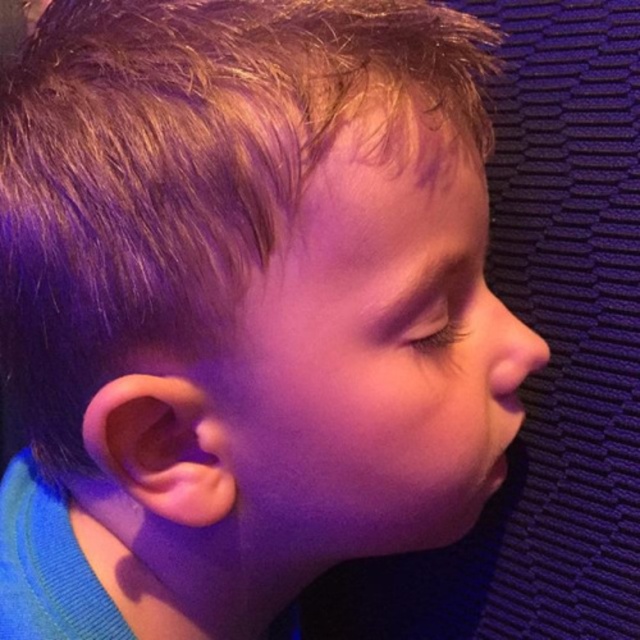
You are a photographer adjusting the lighting for a portrait. The subject has blonde smooth hair at upper left and a smooth flesh nose at center. You need to ensure the lighting reaches both areas equally. Given the distance between them, will you need to adjust the light source closer or farther away to achieve even illumination?

The blonde smooth hair at upper left is 7.15 inches from the smooth flesh nose at center. To achieve even illumination, the light source should be positioned farther away so that the distance difference between the light and both areas is minimized, ensuring consistent lighting across both the blonde smooth hair at upper left and the smooth flesh nose at center.

You are standing in front of the child in the image and want to place a small sticker exactly at point (228, 253). Considering the distance between you and the child, can you estimate how far you need to reach to place the sticker accurately?

The distance between you and point (228, 253) is 12.37 inches, so you need to reach approximately 12.37 inches to place the sticker accurately.

You are a photographer trying to capture a close portrait of a child. You need to ensure that both the blonde smooth hair at upper left and the smooth skin face at center are in focus. Given that your camera can only focus on objects within a 2.5 inch range, will both areas be in focus?

The blonde smooth hair at upper left and smooth skin face at center are 2.68 inches apart from each other. Since the distance exceeds the camera focus range of 2.5 inches, both areas cannot be in focus simultaneously.